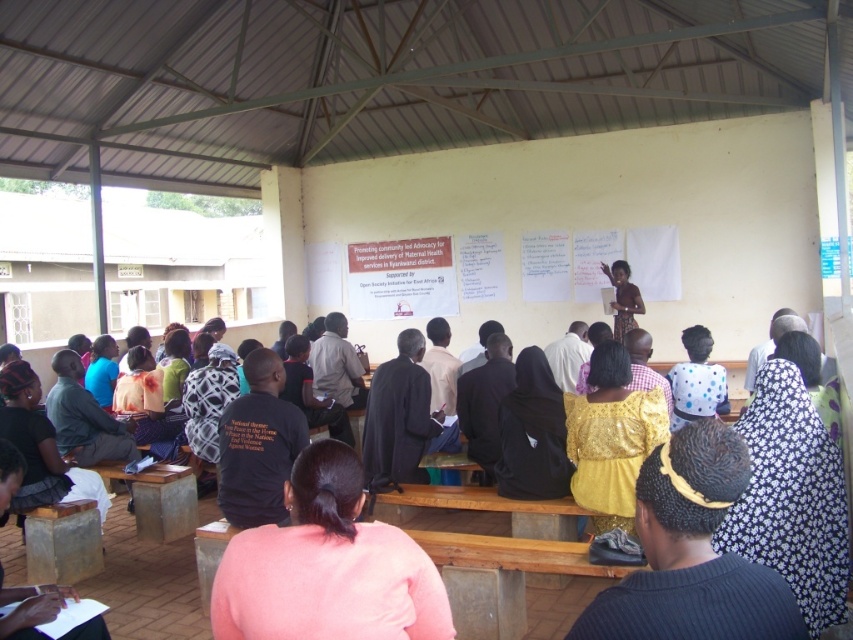
Who is more distant from viewer, [222,595] or [630,477]?

Point [630,477]

Does point (369, 605) come farther from viewer compared to point (598, 522)?

No, it is in front of (598, 522).

Measure the distance between point [312,536] and camera.

Point [312,536] and camera are 7.87 feet apart from each other.

You are a GUI agent. You are given a task and a screenshot of the screen. Output one action in this format:
    pyautogui.click(x=<x>, y=<y>)
    Task: Click on the pink fabric at center
    The image size is (853, 640).
    Given the screenshot: What is the action you would take?
    pyautogui.click(x=328, y=566)

Is floral fabric dress at lower right closer to camera compared to plaid fabric shirt at center?

Yes, floral fabric dress at lower right is in front of plaid fabric shirt at center.

Is floral fabric dress at lower right behind plaid fabric shirt at center?

No.

Who is more distant from viewer, (813, 420) or (219, 394)?

Point (219, 394)

Find the location of a particular element. floral fabric dress at lower right is located at coordinates (791, 497).

Is floral fabric dress at lower right wider than yellow fabric dress at center?

Yes.

Is floral fabric dress at lower right bigger than yellow fabric dress at center?

Actually, floral fabric dress at lower right might be smaller than yellow fabric dress at center.

Is point (782, 374) positioned in front of point (631, 289)?

Yes, point (782, 374) is closer to viewer.

What are the coordinates of `floral fabric dress at lower right` in the screenshot? It's located at (791, 497).